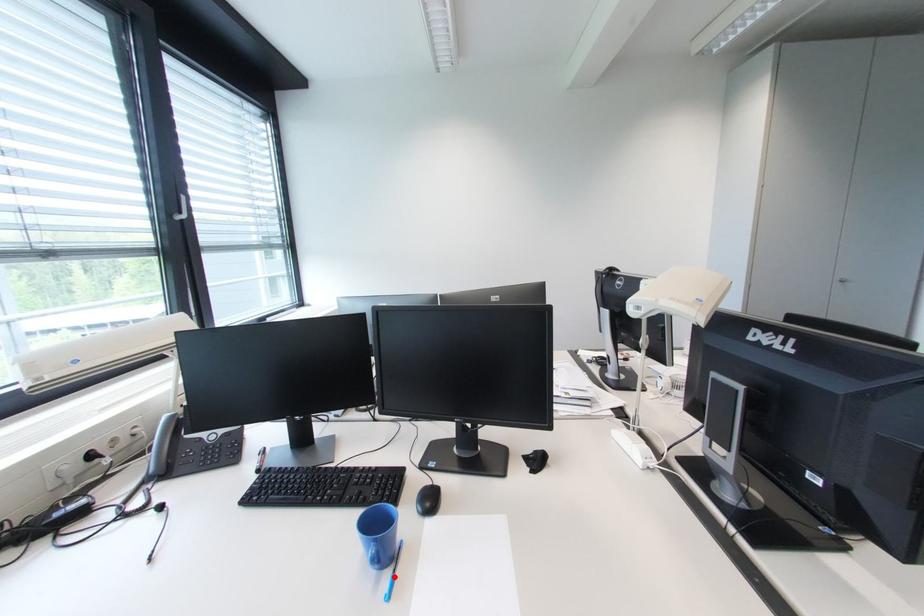
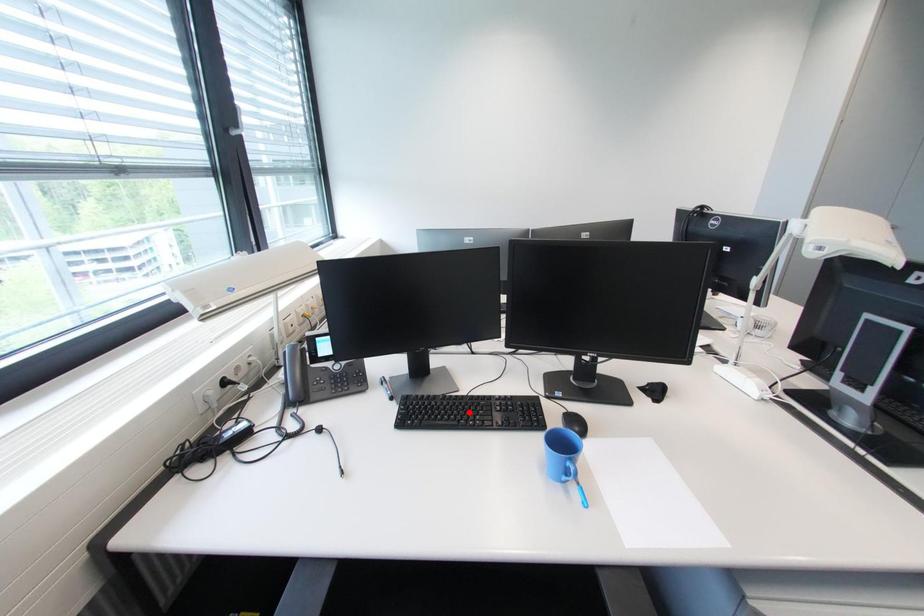
I am providing you with two images of the same scene from different viewpoints. A red point is marked on the first image and another point is marked on the second image. Do the highlighted points in image1 and image2 indicate the same real-world spot?

No